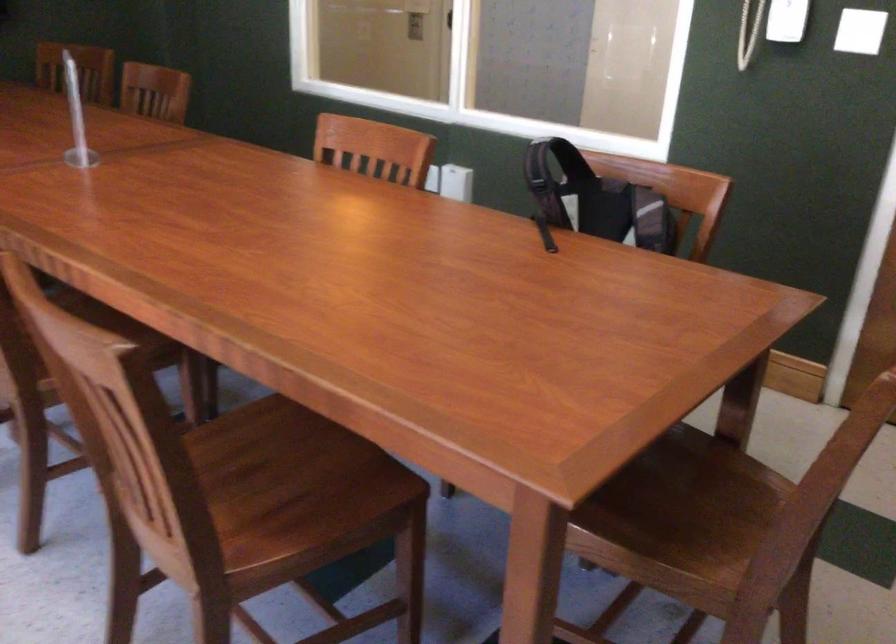
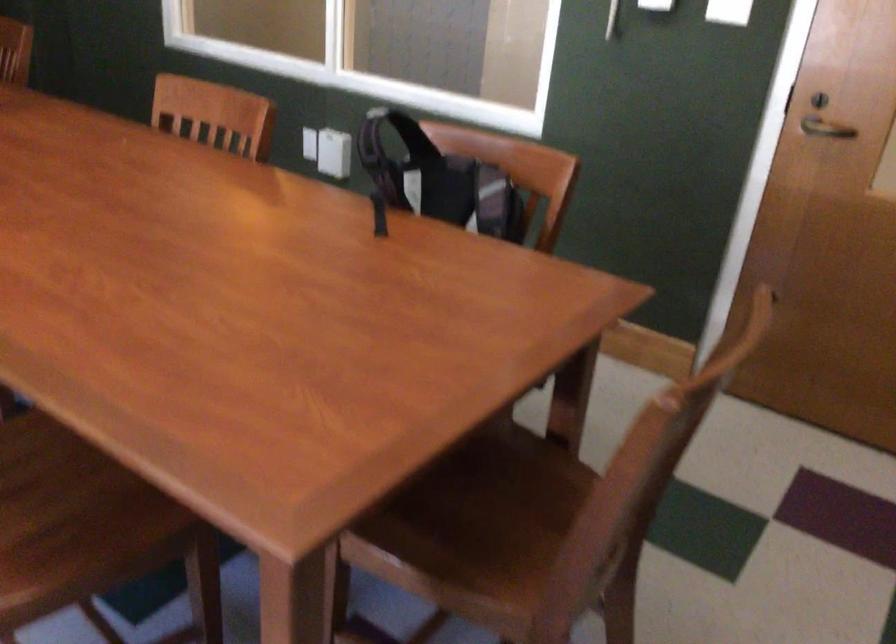
The point at (453, 184) is marked in the first image. Where is the corresponding point in the second image?

(333, 153)